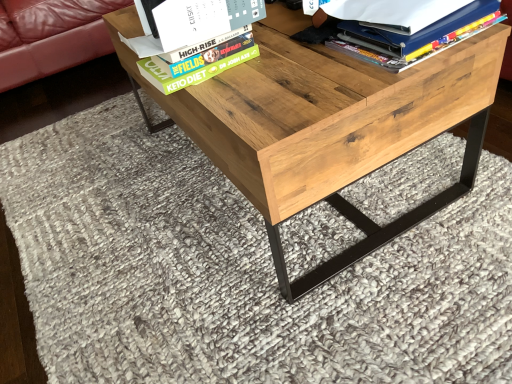
You are a GUI agent. You are given a task and a screenshot of the screen. Output one action in this format:
    pyautogui.click(x=<x>, y=<y>)
    Task: Click on the vacant area that is in front of hardcover book at upper center
    The height and width of the screenshot is (384, 512).
    Given the screenshot: What is the action you would take?
    pyautogui.click(x=241, y=97)